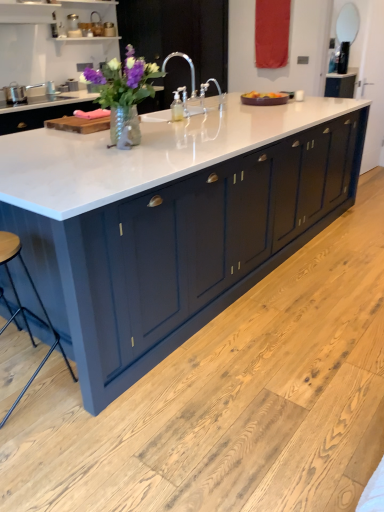
Identify the location of free spot to the right of white glossy sink at center. (220, 113).